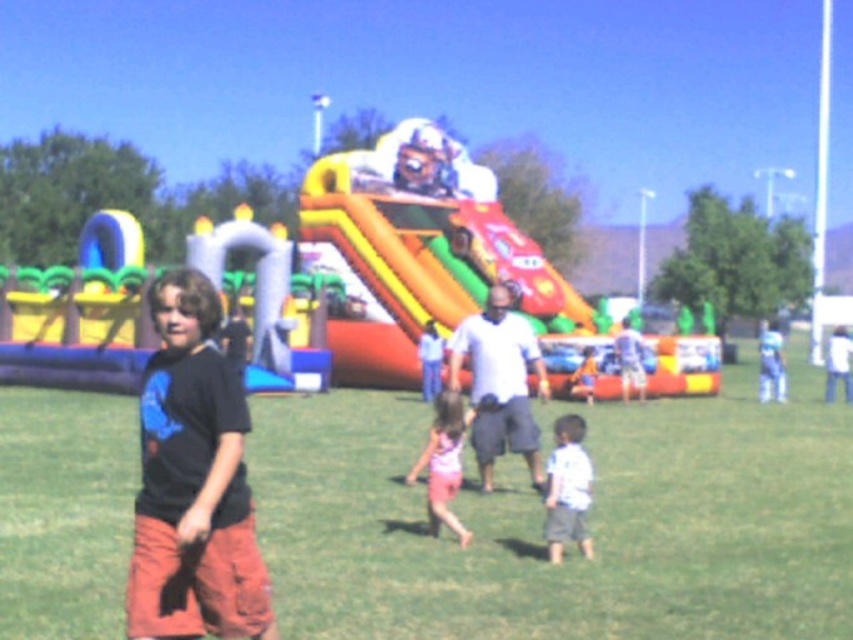
Between point (460, 234) and point (514, 445), which one is positioned in front?

Point (514, 445) is in front.

Is multicolored inflatable slide at center positioned at the back of white matte shirt at center?

Yes, multicolored inflatable slide at center is further from the viewer.

Is point (334, 182) behind point (521, 348)?

Yes, point (334, 182) is behind point (521, 348).

Where is `multicolored inflatable slide at center`? This screenshot has height=640, width=853. multicolored inflatable slide at center is located at coordinates (421, 269).

Between green grass at center and white cotton shirt at center, which one is positioned lower?

Positioned lower is white cotton shirt at center.

Is green grass at center thinner than white cotton shirt at center?

No, green grass at center is not thinner than white cotton shirt at center.

Describe the element at coordinates (589, 518) in the screenshot. This screenshot has width=853, height=640. I see `green grass at center` at that location.

Where is `green grass at center`? The height and width of the screenshot is (640, 853). green grass at center is located at coordinates (589, 518).

Does green grass at center appear on the left side of black cotton t-shirt at left?

No, green grass at center is not to the left of black cotton t-shirt at left.

Where is `green grass at center`? This screenshot has height=640, width=853. green grass at center is located at coordinates coord(589,518).